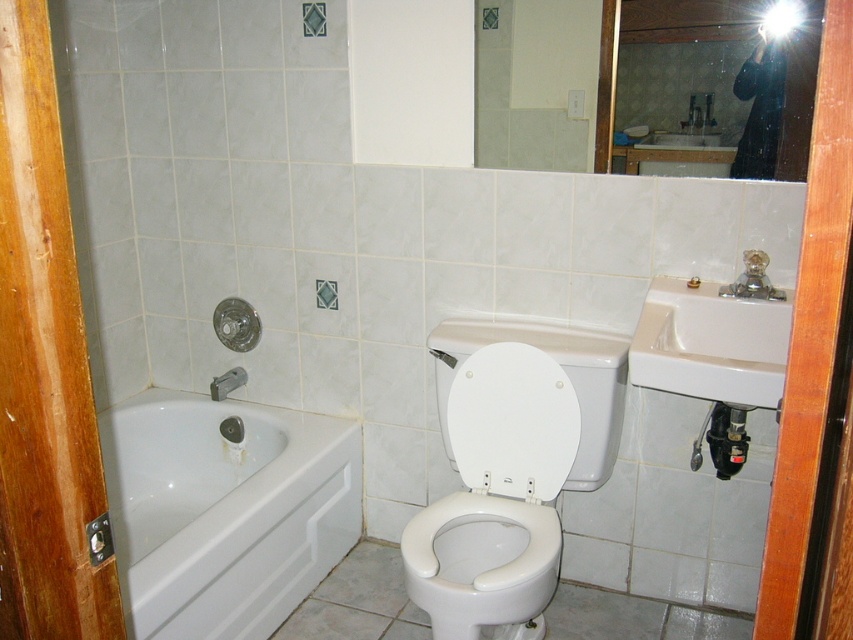
You are a home inspector assessing the bathroom layout. You notice the white plastic toilet seat at center and the black fabric at upper right. Which object is taller when viewed from the bathroom entrance?

The white plastic toilet seat at center is taller than the black fabric at upper right, so when viewed from the bathroom entrance, the white plastic toilet seat at center appears taller.

You are a maintenance worker checking the bathroom. You need to clean the white glossy bathtub at lower left and the matte silver showerhead at lower left. Which one do you need to reach first if you want to start with the one closer to you?

You should start with the white glossy bathtub at lower left because it is closer to the viewer than the matte silver showerhead at lower left.